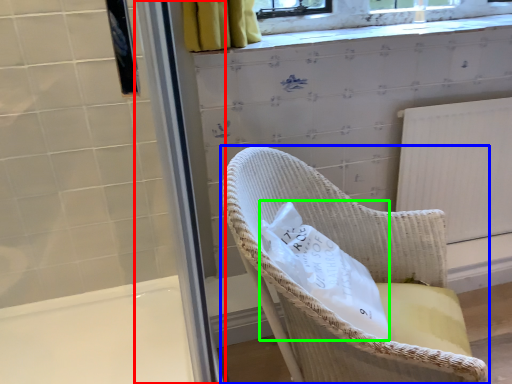
Question: Which object is the closest to the screen door (highlighted by a red box)? Choose among these: chair (highlighted by a blue box) or material (highlighted by a green box).

Choices:
 (A) chair
 (B) material

Answer: (B)